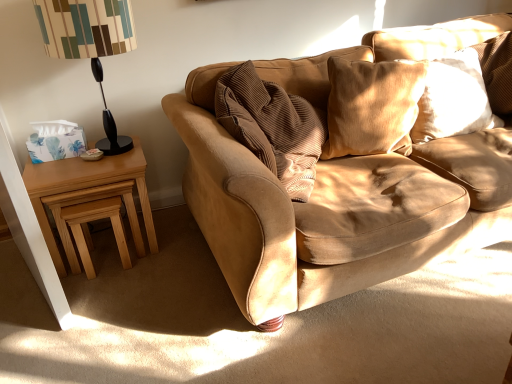
This screenshot has width=512, height=384. In order to click on free space in front of light brown wood nesting tables at left in this screenshot , I will do `click(93, 300)`.